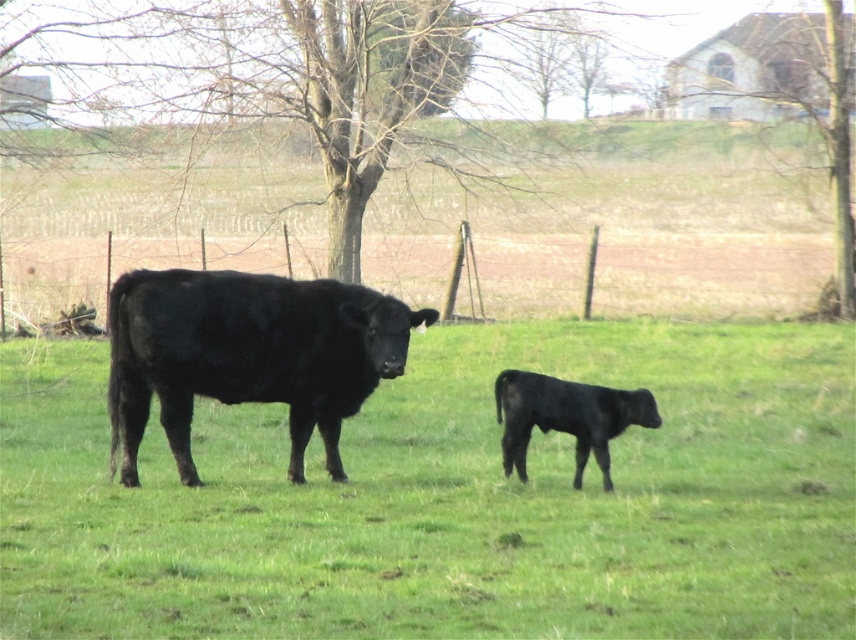
You are standing in the field and see two points marked in the image. The first point is at coordinate point(x=312, y=300) and the second is at point(x=563, y=419). Which point is closer to you?

The point at point(x=563, y=419) is closer to you because the point at point(x=312, y=300) is behind it.

You are a farmer who wants to place a new water trough between the bare wood tree at center and the shiny black bull at center. The trough requires 10 feet of space around it. Is there enough space between them to place the trough?

The distance between the bare wood tree at center and the shiny black bull at center is 40.47 feet. Subtracting the required 10 feet of space around the trough, there is sufficient space to place the trough between them.

You are a farmer standing at the edge of the field where the two black cows are grazing. You want to place a new fence post exactly at the location of the bare wood tree at center. What are the coordinates where you should place the new fence post?

The coordinates for the bare wood tree at center are at point [280,70]. Therefore, the new fence post should be placed at those coordinates.